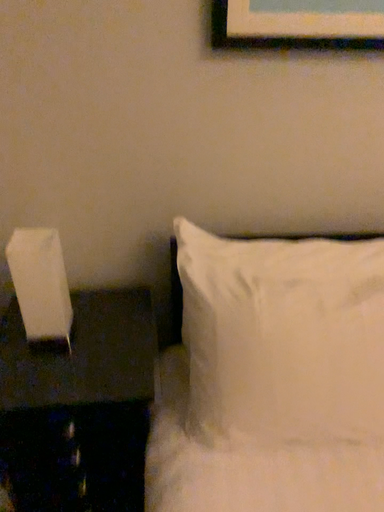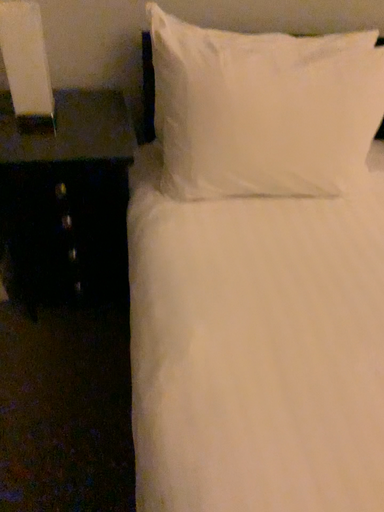
Question: How did the camera likely rotate when shooting the video?

Choices:
 (A) rotated downward
 (B) rotated upward

Answer: (A)